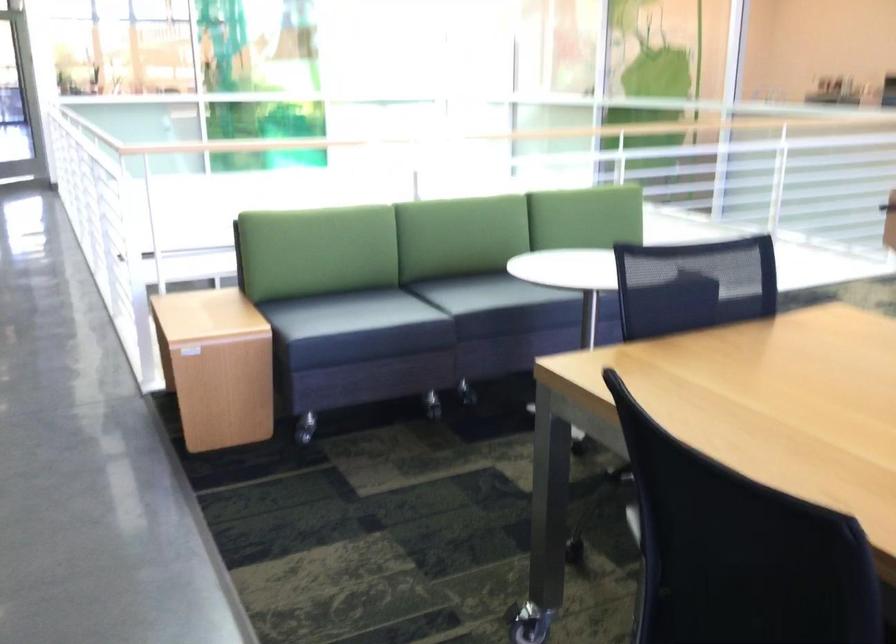
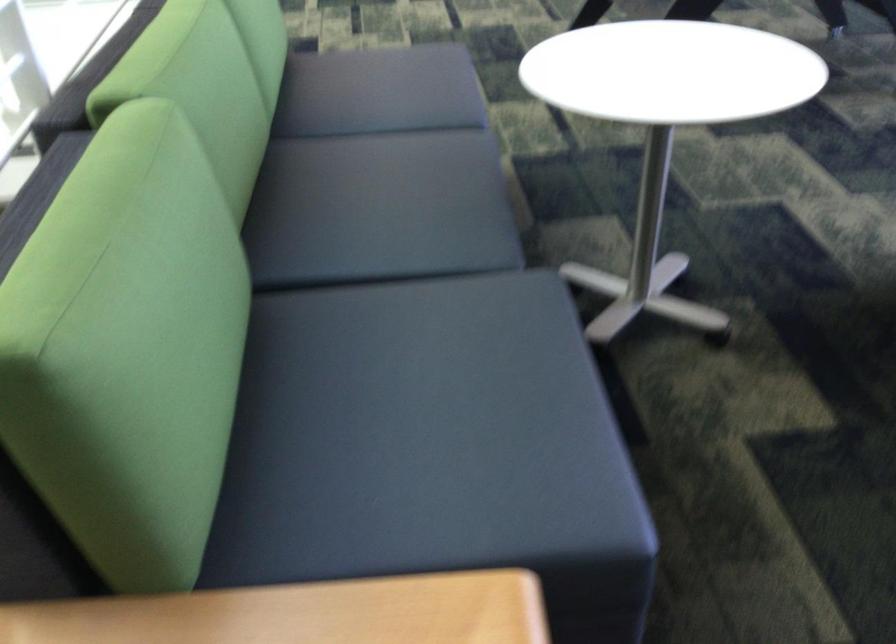
Locate, in the second image, the point that corresponds to point (255, 317) in the first image.

(423, 438)